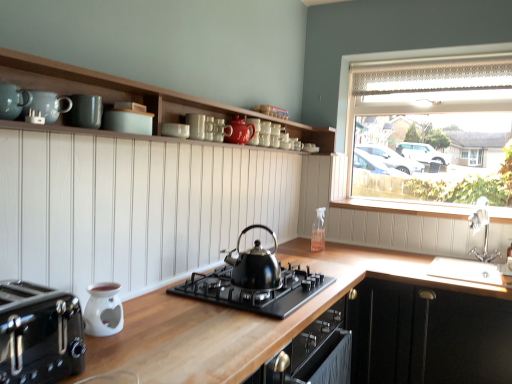
This screenshot has width=512, height=384. Identify the location of spots to the right of white ceramic oil burner at lower left, which appears as the 2th kitchen appliance when viewed from the front. (162, 332).